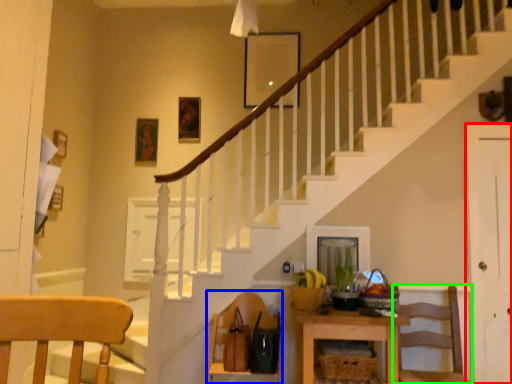
Question: Estimate the real-world distances between objects in this image. Which object is closer to door (highlighted by a red box), chair (highlighted by a blue box) or chair (highlighted by a green box)?

Choices:
 (A) chair
 (B) chair

Answer: (B)